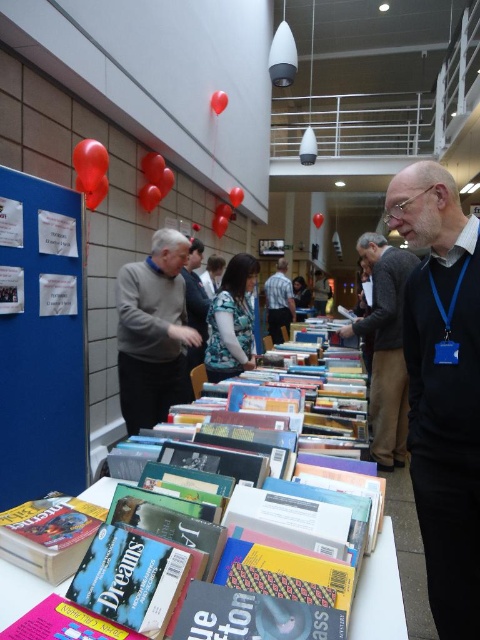
Consider the image. Does dark gray sweater at center have a lesser width compared to striped shirt at center?

In fact, dark gray sweater at center might be wider than striped shirt at center.

Based on the photo, is dark gray sweater at center positioned at the back of striped shirt at center?

No, it is not.

Does point (385, 248) come behind point (269, 321)?

That is False.

Image resolution: width=480 pixels, height=640 pixels. Identify the location of dark gray sweater at center. (385, 348).

Is blue matte board at left thinner than striped shirt at center?

Correct, blue matte board at left's width is less than striped shirt at center's.

Can you confirm if blue matte board at left is positioned to the right of striped shirt at center?

In fact, blue matte board at left is to the left of striped shirt at center.

Is point (24, 339) in front of point (288, 314)?

Yes, point (24, 339) is in front of point (288, 314).

Locate an element on the screen. blue matte board at left is located at coordinates (40, 340).

Can you confirm if gray wool sweater at center is bigger than blue textured blouse at center?

Yes.

Between point (136, 365) and point (217, 339), which one is positioned in front?

Point (136, 365) is in front.

The height and width of the screenshot is (640, 480). Identify the location of gray wool sweater at center. (154, 332).